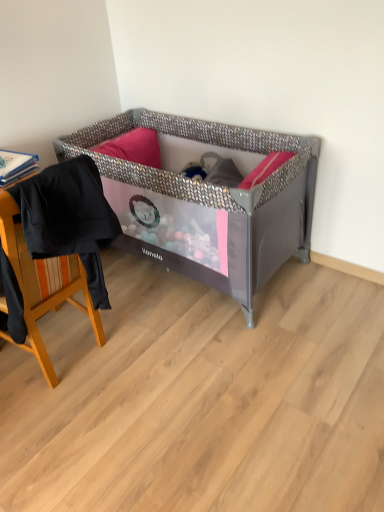
Locate an element on the screen. The image size is (384, 512). vacant area that lies in front of metallic gray playpen at center is located at coordinates (210, 386).